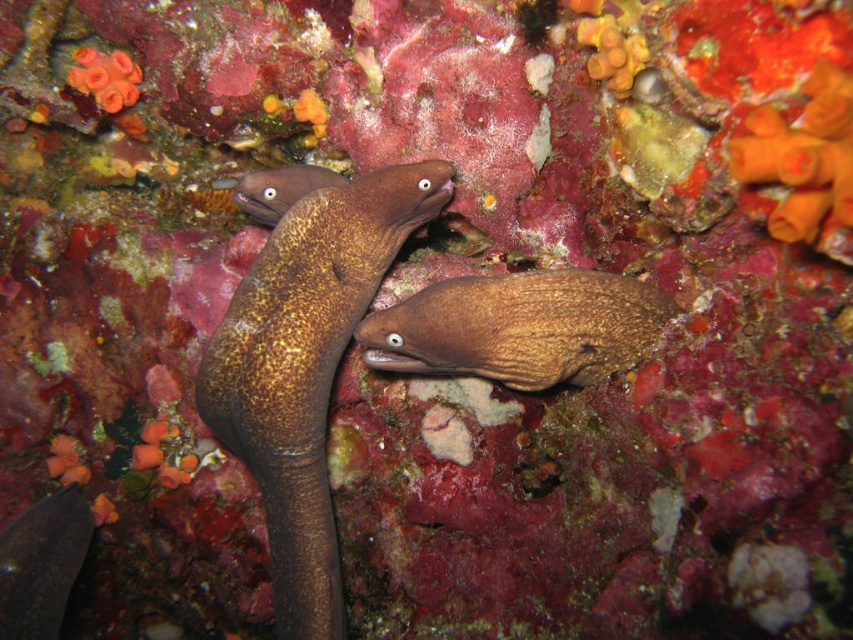
Question: Is shiny brown eel at center above brown textured eel at center?

Choices:
 (A) yes
 (B) no

Answer: (B)

Question: Can you confirm if shiny brown eel at center is bigger than brown textured eel at center?

Choices:
 (A) yes
 (B) no

Answer: (A)

Question: Considering the relative positions of shiny brown eel at center and brown textured eel at center in the image provided, where is shiny brown eel at center located with respect to brown textured eel at center?

Choices:
 (A) right
 (B) left

Answer: (B)

Question: Which point is farther from the camera taking this photo?

Choices:
 (A) (631, 346)
 (B) (264, 422)

Answer: (A)